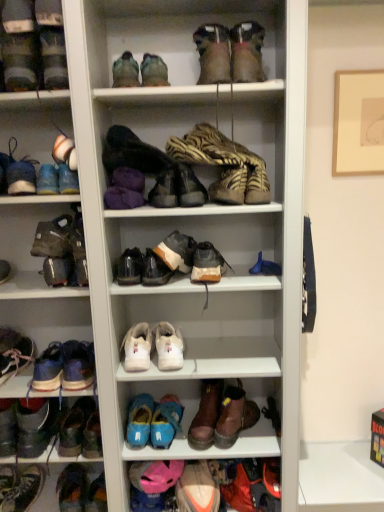
Question: Can you confirm if leather/textured boot at center, arranged as the 4th footwear when ordered from the bottom, is thinner than orange suede sneaker at lower center, which is the third shoe from bottom to top?

Choices:
 (A) yes
 (B) no

Answer: (A)

Question: Does leather/textured boot at center, the first footwear from the right, have a smaller size compared to orange suede sneaker at lower center, which is the third shoe from bottom to top?

Choices:
 (A) yes
 (B) no

Answer: (B)

Question: From the image's perspective, does leather/textured boot at center, the first footwear from the right, appear lower than orange suede sneaker at lower center, which is the third shoe from bottom to top?

Choices:
 (A) no
 (B) yes

Answer: (A)

Question: Can you see leather/textured boot at center, the first footwear from the right, touching orange suede sneaker at lower center, the sixteenth shoe when ordered from top to bottom?

Choices:
 (A) yes
 (B) no

Answer: (B)

Question: Considering the relative positions of leather/textured boot at center, the first footwear from the right, and orange suede sneaker at lower center, which is the third shoe from bottom to top, in the image provided, is leather/textured boot at center, the first footwear from the right, to the right of orange suede sneaker at lower center, which is the third shoe from bottom to top, from the viewer's perspective?

Choices:
 (A) no
 (B) yes

Answer: (B)

Question: Considering the positions of matte blue sneaker at left, which is the sixteenth shoe in bottom-to-top order, and shiny black shoe at lower left, the 18th shoe when ordered from top to bottom, in the image, is matte blue sneaker at left, which is the sixteenth shoe in bottom-to-top order, taller or shorter than shiny black shoe at lower left, the 18th shoe when ordered from top to bottom,?

Choices:
 (A) short
 (B) tall

Answer: (B)

Question: Considering their positions, is matte blue sneaker at left, acting as the third shoe starting from the top, located in front of or behind shiny black shoe at lower left, the 18th shoe when ordered from top to bottom?

Choices:
 (A) behind
 (B) front

Answer: (B)

Question: Does point (8, 154) appear closer or farther from the camera than point (19, 505)?

Choices:
 (A) farther
 (B) closer

Answer: (B)

Question: Based on their sizes in the image, would you say matte blue sneaker at left, which is the sixteenth shoe in bottom-to-top order, is bigger or smaller than shiny black shoe at lower left, the first shoe from the bottom?

Choices:
 (A) small
 (B) big

Answer: (A)

Question: Is brown leather boot at lower center, the twelfth shoe from the top, spatially inside white leather sneakers at center, the 8th shoe from the bottom, or outside of it?

Choices:
 (A) inside
 (B) outside

Answer: (B)

Question: Does point (213, 424) appear closer or farther from the camera than point (142, 357)?

Choices:
 (A) closer
 (B) farther

Answer: (B)

Question: In the image, is brown leather boot at lower center, the twelfth shoe from the top, positioned in front of or behind white leather sneakers at center, positioned as the 11th shoe in top-to-bottom order?

Choices:
 (A) front
 (B) behind

Answer: (B)

Question: Is brown leather boot at lower center, the twelfth shoe from the top, wider or thinner than white leather sneakers at center, positioned as the 11th shoe in top-to-bottom order?

Choices:
 (A) wide
 (B) thin

Answer: (A)

Question: Does point (61, 175) appear closer or farther from the camera than point (41, 482)?

Choices:
 (A) farther
 (B) closer

Answer: (B)

Question: Considering the positions of matte black shoe at upper left, arranged as the 4th shoe when viewed from the top, and shiny black shoe at lower left, the 18th shoe when ordered from top to bottom, in the image, is matte black shoe at upper left, arranged as the 4th shoe when viewed from the top, wider or thinner than shiny black shoe at lower left, the 18th shoe when ordered from top to bottom,?

Choices:
 (A) thin
 (B) wide

Answer: (A)